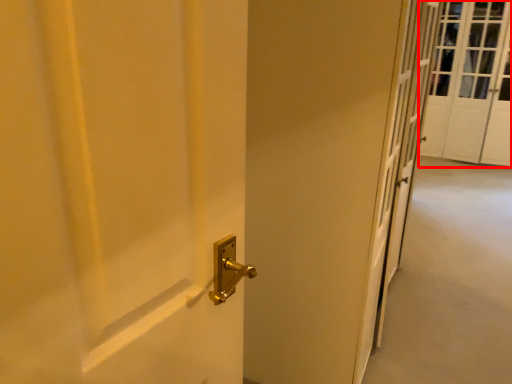
Question: From the image's perspective, where is screen door (annotated by the red box) located relative to corridor?

Choices:
 (A) below
 (B) above

Answer: (B)